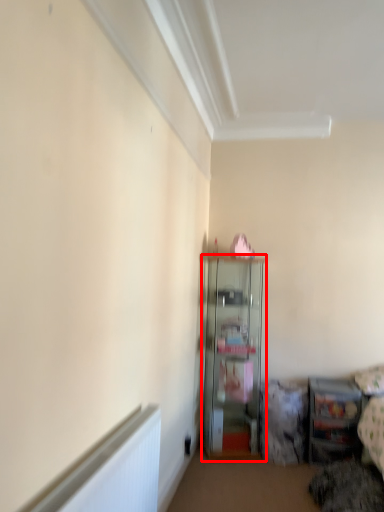
Question: From the image's perspective, what is the correct spatial relationship of shelf (annotated by the red box) in relation to shelf?

Choices:
 (A) below
 (B) above

Answer: (B)